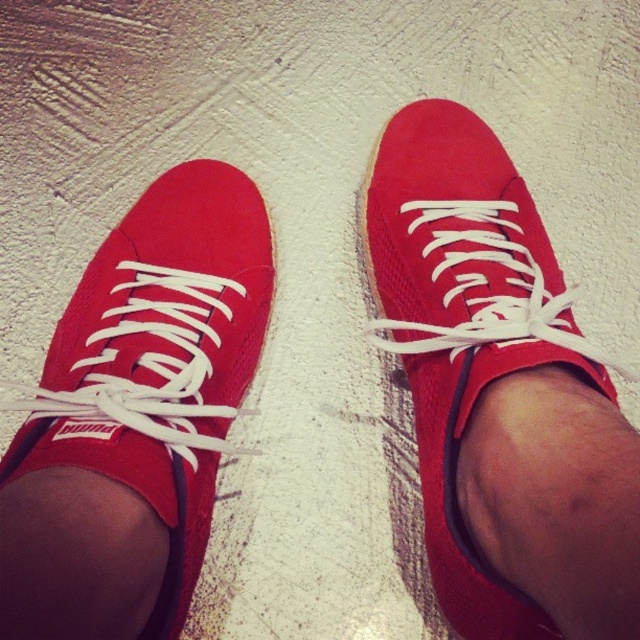
Question: From the image, what is the correct spatial relationship of matte red sneaker at center in relation to suede/red shoe at center?

Choices:
 (A) left
 (B) right

Answer: (A)

Question: Which object is closer to the camera taking this photo?

Choices:
 (A) matte red sneaker at center
 (B) suede/red shoe at center

Answer: (A)

Question: Does matte red sneaker at center lie behind suede/red shoe at center?

Choices:
 (A) yes
 (B) no

Answer: (B)

Question: Can you confirm if matte red sneaker at center is positioned to the left of suede/red shoe at center?

Choices:
 (A) yes
 (B) no

Answer: (A)